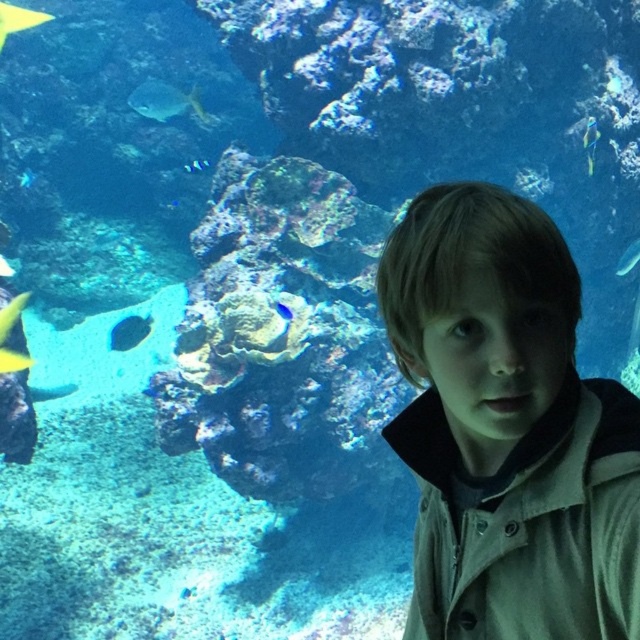
What do you see at coordinates (129, 332) in the screenshot? This screenshot has height=640, width=640. I see `shiny blue fish at center-left` at bounding box center [129, 332].

Between shiny blue fish at center-left and shiny blue fish at upper center, which one appears on the left side from the viewer's perspective?

shiny blue fish at center-left

Where is `shiny blue fish at center-left`? This screenshot has width=640, height=640. shiny blue fish at center-left is located at coordinates (129, 332).

The height and width of the screenshot is (640, 640). In order to click on shiny silver fish at upper center in this screenshot , I will do `click(163, 100)`.

Between shiny silver fish at upper center and blue glossy fish at center, which one is positioned higher?

shiny silver fish at upper center is above.

Does point (148, 81) come behind point (291, 310)?

Yes, point (148, 81) is behind point (291, 310).

You are a GUI agent. You are given a task and a screenshot of the screen. Output one action in this format:
    pyautogui.click(x=<x>, y=<y>)
    Task: Click on the shiny silver fish at upper center
    
    Given the screenshot: What is the action you would take?
    pyautogui.click(x=163, y=100)

Does yellow matte fish at left appear on the left side of blue glossy fish at center?

Correct, you'll find yellow matte fish at left to the left of blue glossy fish at center.

Who is higher up, yellow matte fish at left or blue glossy fish at center?

blue glossy fish at center is higher up.

Describe the element at coordinates (8, 332) in the screenshot. I see `yellow matte fish at left` at that location.

Identify the location of yellow matte fish at left. (8, 332).